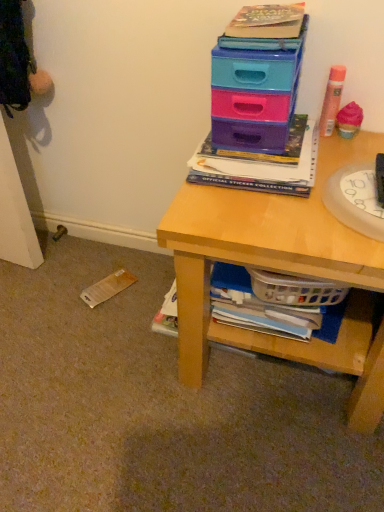
Question: From the image's perspective, is transparent plastic plate at right beneath matte plastic drawers at upper right?

Choices:
 (A) no
 (B) yes

Answer: (B)

Question: Can you confirm if transparent plastic plate at right is smaller than matte plastic drawers at upper right?

Choices:
 (A) yes
 (B) no

Answer: (A)

Question: From a real-world perspective, is transparent plastic plate at right below matte plastic drawers at upper right?

Choices:
 (A) yes
 (B) no

Answer: (A)

Question: Is transparent plastic plate at right bigger than matte plastic drawers at upper right?

Choices:
 (A) yes
 (B) no

Answer: (B)

Question: Does transparent plastic plate at right lie behind matte plastic drawers at upper right?

Choices:
 (A) no
 (B) yes

Answer: (A)

Question: In terms of size, does wooden desk at upper right appear bigger or smaller than hardcover book at upper center?

Choices:
 (A) big
 (B) small

Answer: (A)

Question: Considering their positions, is wooden desk at upper right located in front of or behind hardcover book at upper center?

Choices:
 (A) front
 (B) behind

Answer: (A)

Question: Does point (x=324, y=245) appear closer or farther from the camera than point (x=304, y=194)?

Choices:
 (A) farther
 (B) closer

Answer: (B)

Question: Based on their positions, is wooden desk at upper right located to the left or right of hardcover book at upper center?

Choices:
 (A) right
 (B) left

Answer: (A)

Question: Considering the positions of point (180, 298) and point (334, 192), is point (180, 298) closer or farther from the camera than point (334, 192)?

Choices:
 (A) farther
 (B) closer

Answer: (A)

Question: Would you say wooden desk at upper right is to the left or to the right of transparent plastic plate at right in the picture?

Choices:
 (A) right
 (B) left

Answer: (B)

Question: Looking at their shapes, would you say wooden desk at upper right is wider or thinner than transparent plastic plate at right?

Choices:
 (A) wide
 (B) thin

Answer: (A)

Question: Based on their sizes in the image, would you say wooden desk at upper right is bigger or smaller than transparent plastic plate at right?

Choices:
 (A) big
 (B) small

Answer: (A)

Question: Which is correct: matte plastic drawers at upper right is inside wooden desk at upper right, or outside of it?

Choices:
 (A) inside
 (B) outside

Answer: (B)

Question: Considering the positions of point (233, 99) and point (200, 330), is point (233, 99) closer or farther from the camera than point (200, 330)?

Choices:
 (A) closer
 (B) farther

Answer: (A)